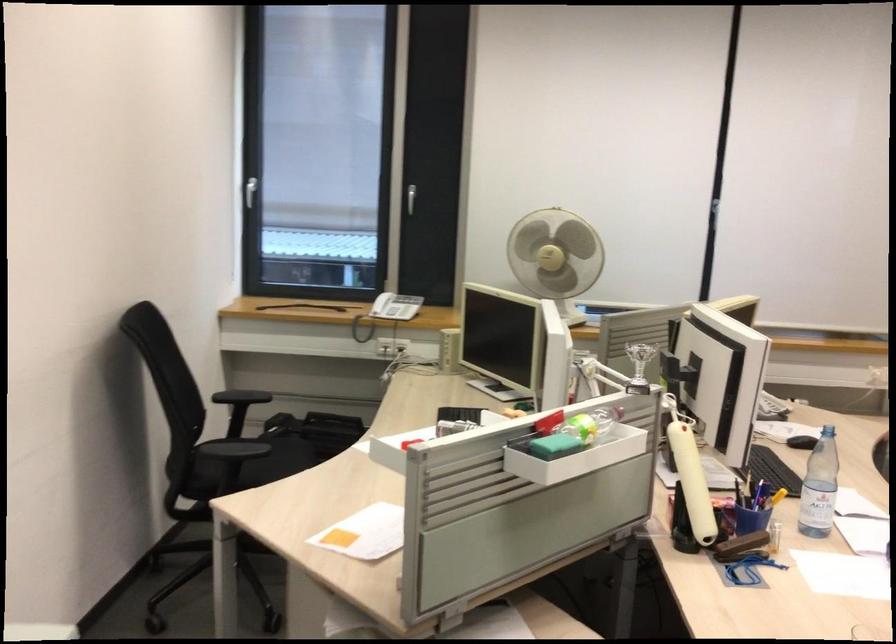
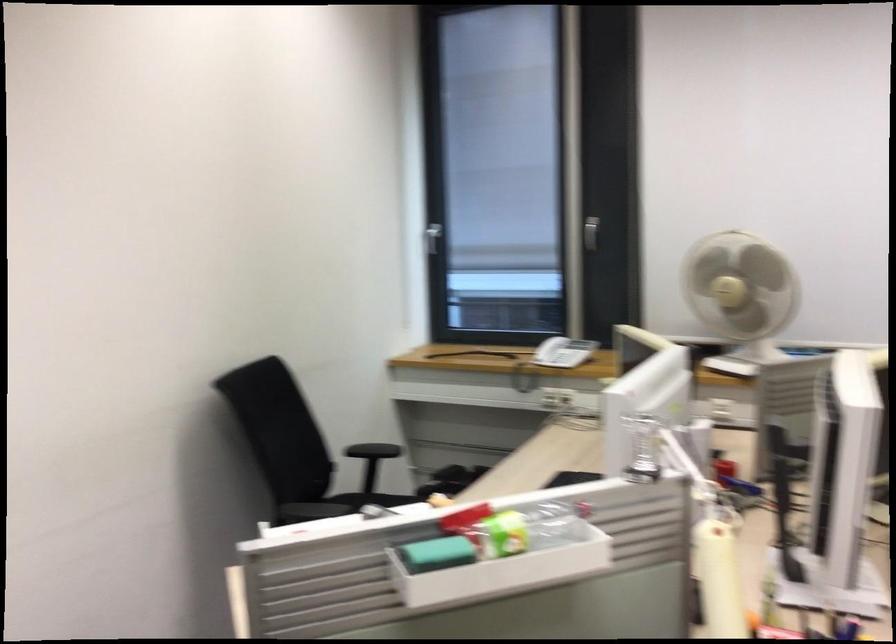
The images are taken continuously from a first-person perspective. In which direction are you moving?

The movement direction of the cameraman is right, forward.